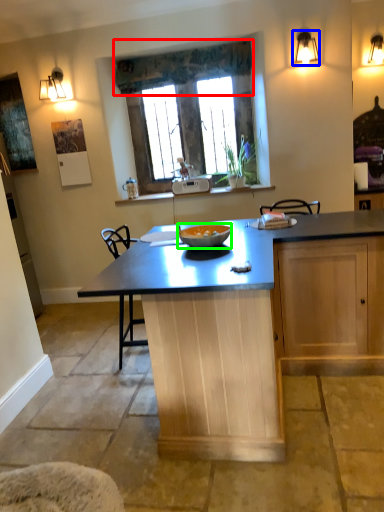
Question: Which object is the farthest from curtain (highlighted by a red box)? Choose among these: light fixture (highlighted by a blue box) or glass bowl (highlighted by a green box).

Choices:
 (A) light fixture
 (B) glass bowl

Answer: (B)